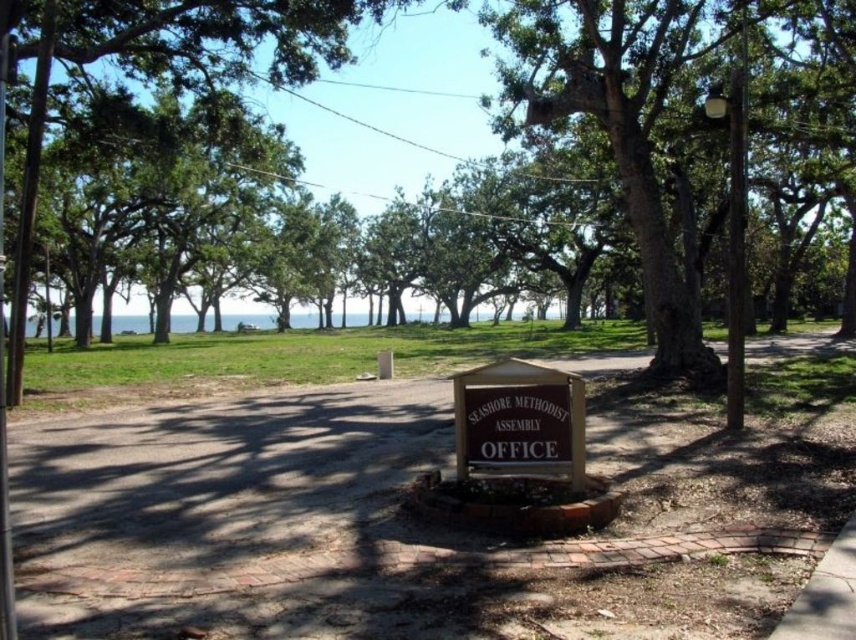
Question: Can you confirm if brown brick pavement at center is positioned to the left of brown wooden sign at center?

Choices:
 (A) no
 (B) yes

Answer: (A)

Question: Among these points, which one is farthest from the camera?

Choices:
 (A) (491, 388)
 (B) (533, 582)

Answer: (A)

Question: Can you confirm if brown brick pavement at center is positioned to the right of brown wooden sign at center?

Choices:
 (A) yes
 (B) no

Answer: (A)

Question: Is brown brick pavement at center positioned behind brown wooden sign at center?

Choices:
 (A) yes
 (B) no

Answer: (B)

Question: Which object appears closest to the camera in this image?

Choices:
 (A) brown brick pavement at center
 (B) brown wooden sign at center

Answer: (A)